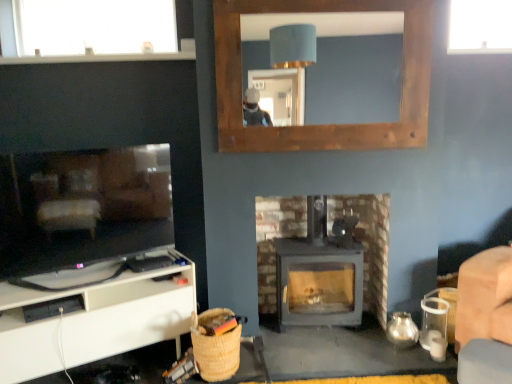
Question: Is transparent glass window at upper right, placed as the first window when sorted from right to left, taller than white matte cabinet at lower left?

Choices:
 (A) no
 (B) yes

Answer: (A)

Question: From a real-world perspective, is transparent glass window at upper right, placed as the second window when sorted from left to right, below white matte cabinet at lower left?

Choices:
 (A) yes
 (B) no

Answer: (B)

Question: Can you confirm if transparent glass window at upper right, placed as the second window when sorted from left to right, is positioned to the left of white matte cabinet at lower left?

Choices:
 (A) yes
 (B) no

Answer: (B)

Question: From a real-world perspective, does transparent glass window at upper right, placed as the first window when sorted from right to left, stand above white matte cabinet at lower left?

Choices:
 (A) yes
 (B) no

Answer: (A)

Question: Are transparent glass window at upper right, placed as the second window when sorted from left to right, and white matte cabinet at lower left far apart?

Choices:
 (A) no
 (B) yes

Answer: (B)

Question: Relative to white matte cabinet at lower left, is transparent glass window at upper right, placed as the first window when sorted from right to left, in front or behind?

Choices:
 (A) behind
 (B) front

Answer: (A)

Question: From a real-world perspective, relative to white matte cabinet at lower left, is transparent glass window at upper right, placed as the second window when sorted from left to right, vertically above or below?

Choices:
 (A) below
 (B) above

Answer: (B)

Question: Is transparent glass window at upper right, placed as the second window when sorted from left to right, wider or thinner than white matte cabinet at lower left?

Choices:
 (A) thin
 (B) wide

Answer: (A)

Question: Is transparent glass window at upper right, placed as the first window when sorted from right to left, taller or shorter than white matte cabinet at lower left?

Choices:
 (A) short
 (B) tall

Answer: (A)

Question: Is wooden frame mirror at upper center to the left or to the right of transparent glass window at upper right, placed as the first window when sorted from right to left, in the image?

Choices:
 (A) left
 (B) right

Answer: (A)

Question: Looking at the image, does wooden frame mirror at upper center seem bigger or smaller compared to transparent glass window at upper right, placed as the first window when sorted from right to left?

Choices:
 (A) big
 (B) small

Answer: (A)

Question: Is wooden frame mirror at upper center taller or shorter than transparent glass window at upper right, placed as the first window when sorted from right to left?

Choices:
 (A) short
 (B) tall

Answer: (B)

Question: From the image's perspective, is wooden frame mirror at upper center above or below transparent glass window at upper right, placed as the first window when sorted from right to left?

Choices:
 (A) below
 (B) above

Answer: (A)

Question: In terms of height, does transparent glass window at upper left, the second window viewed from the right, look taller or shorter compared to transparent glass window at upper right, placed as the first window when sorted from right to left?

Choices:
 (A) tall
 (B) short

Answer: (A)

Question: From the image's perspective, relative to transparent glass window at upper right, placed as the first window when sorted from right to left, is transparent glass window at upper left, arranged as the first window when viewed from the left, above or below?

Choices:
 (A) above
 (B) below

Answer: (B)